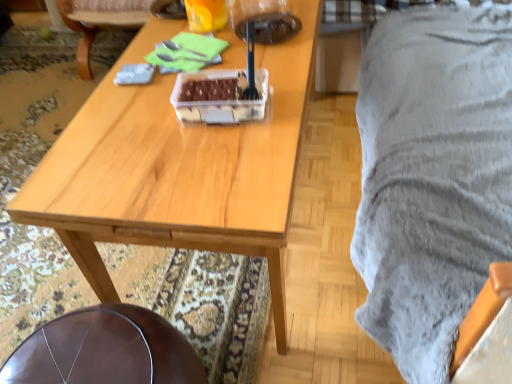
Question: Considering the positions of leather seat at lower left, which is the first chair from front to back, and translucent plastic cup at upper center in the image, is leather seat at lower left, which is the first chair from front to back, bigger or smaller than translucent plastic cup at upper center?

Choices:
 (A) big
 (B) small

Answer: (A)

Question: In terms of width, does leather seat at lower left, which appears as the second chair when viewed from the top, look wider or thinner when compared to translucent plastic cup at upper center?

Choices:
 (A) thin
 (B) wide

Answer: (B)

Question: Which of these objects is positioned closest to the wooden table at center?

Choices:
 (A) leather seat at lower left, which is the first chair from front to back
 (B) translucent plastic cup at upper center
 (C) translucent plastic container at center
 (D) brown leather chair at center, which appears as the second chair when viewed from the front

Answer: (C)

Question: Which object is the closest to the translucent plastic container at center?

Choices:
 (A) leather seat at lower left, which appears as the second chair when viewed from the top
 (B) brown leather chair at center, which appears as the second chair when viewed from the front
 (C) translucent plastic cup at upper center
 (D) wooden table at center

Answer: (D)